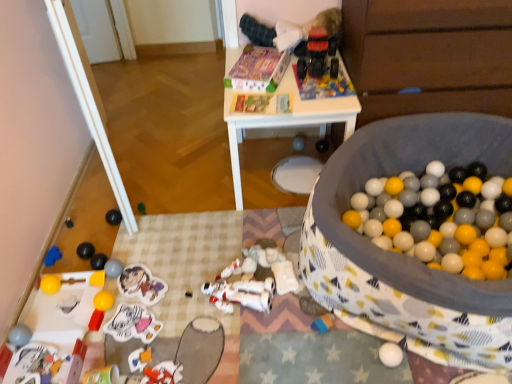
Find the location of a particular element. The image size is (512, 384). free space between matte cardboard stickers at lower center, which appears as the ninth toy when viewed from the right, and white fabric doll at center, placed as the fifth toy when sorted from right to left is located at coordinates (192, 285).